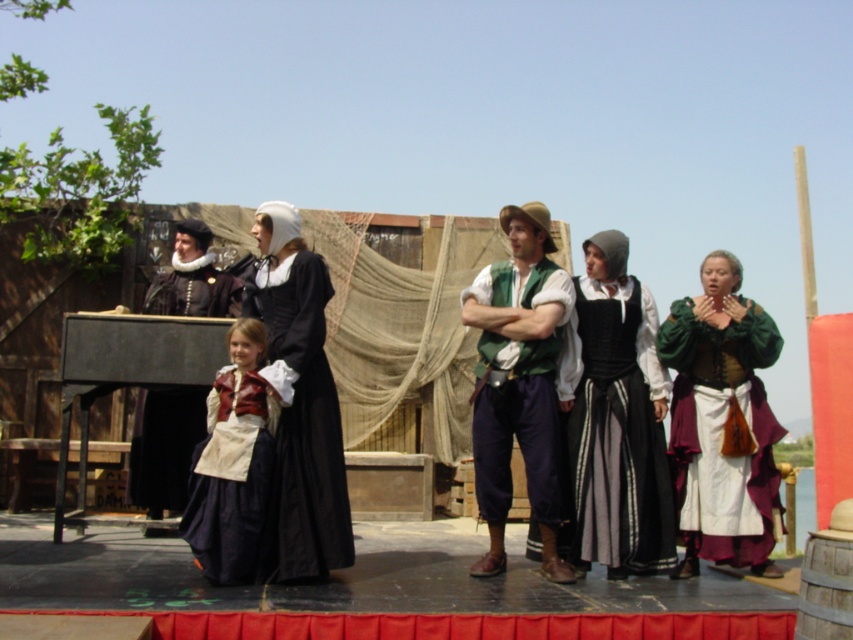
Is black velvet dress at center bigger than matte black dress at center?

No, black velvet dress at center is not bigger than matte black dress at center.

This screenshot has height=640, width=853. What are the coordinates of `black velvet dress at center` in the screenshot? It's located at (614, 419).

Does matte red dress at center appear on the right side of matte black dress at left?

Indeed, matte red dress at center is positioned on the right side of matte black dress at left.

Can you confirm if matte red dress at center is positioned above matte black dress at left?

Correct, matte red dress at center is located above matte black dress at left.

Who is more forward, (231, 541) or (190, 284)?

Positioned in front is point (231, 541).

What are the coordinates of `matte red dress at center` in the screenshot? It's located at (233, 461).

How far apart are green fabric vest at center and matte black dress at left?

The distance of green fabric vest at center from matte black dress at left is 4.12 meters.

Locate an element on the screen. The height and width of the screenshot is (640, 853). green fabric vest at center is located at coordinates (518, 381).

Does point (473, 454) come farther from viewer compared to point (190, 316)?

No.

Locate an element on the screen. The height and width of the screenshot is (640, 853). green fabric vest at center is located at coordinates (518, 381).